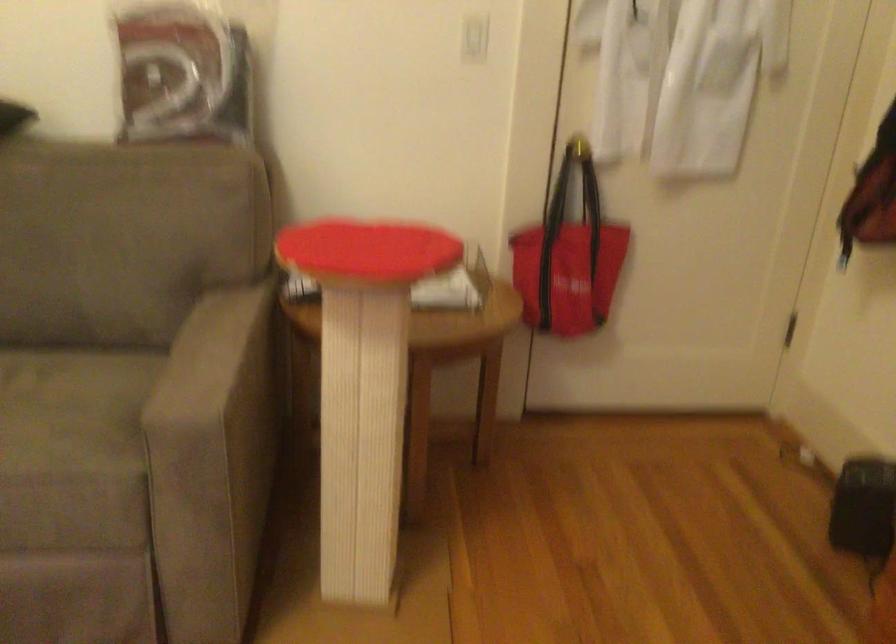
Identify the location of gold door knob. (579, 147).